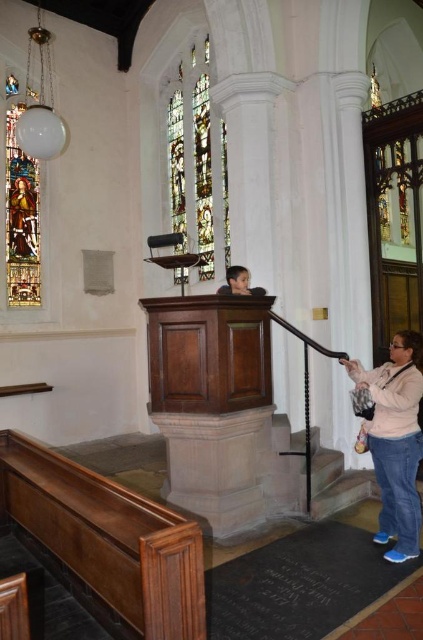
Which of these two, stained glass window at upper center or pink fabric at lower right, stands shorter?

pink fabric at lower right is shorter.

Can you confirm if stained glass window at upper center is taller than pink fabric at lower right?

Indeed, stained glass window at upper center has a greater height compared to pink fabric at lower right.

You are a GUI agent. You are given a task and a screenshot of the screen. Output one action in this format:
    pyautogui.click(x=<x>, y=<y>)
    Task: Click on the stained glass window at upper center
    This screenshot has width=423, height=640.
    Given the screenshot: What is the action you would take?
    pyautogui.click(x=197, y=164)

The height and width of the screenshot is (640, 423). I want to click on stained glass window at upper center, so pyautogui.click(x=197, y=164).

Is stained glass window at upper center behind stained glass window at upper left?

No, it is in front of stained glass window at upper left.

Who is higher up, stained glass window at upper center or stained glass window at upper left?

stained glass window at upper center

Is point (200, 51) more distant than point (36, 236)?

Yes, it is.

What are the coordinates of `stained glass window at upper center` in the screenshot? It's located at (197, 164).

Does pink fabric at lower right come behind stained glass window at upper left?

No, it is not.

Does pink fabric at lower right have a lesser width compared to stained glass window at upper left?

No.

Where is `pink fabric at lower right`? The image size is (423, 640). pink fabric at lower right is located at coordinates (395, 440).

The image size is (423, 640). What are the coordinates of `pink fabric at lower right` in the screenshot? It's located at (395, 440).